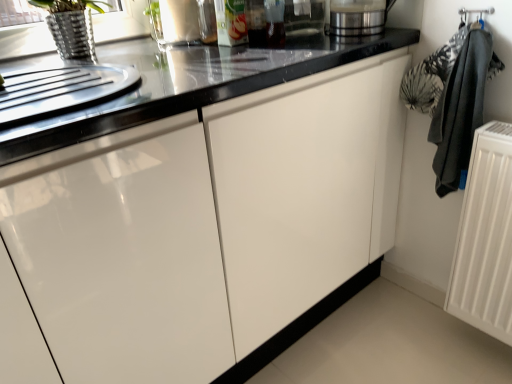
Question: Does black fabric laundry at right lie in front of satin silver blender at upper right, arranged as the second appliance when viewed from the left?

Choices:
 (A) yes
 (B) no

Answer: (A)

Question: From a real-world perspective, is black fabric laundry at right on top of satin silver blender at upper right, arranged as the second appliance when viewed from the left?

Choices:
 (A) yes
 (B) no

Answer: (B)

Question: Does black fabric laundry at right have a lesser width compared to satin silver blender at upper right, the 1th appliance positioned from the right?

Choices:
 (A) yes
 (B) no

Answer: (A)

Question: Can you see black fabric laundry at right touching satin silver blender at upper right, arranged as the second appliance when viewed from the left?

Choices:
 (A) yes
 (B) no

Answer: (B)

Question: Is black fabric laundry at right facing away from satin silver blender at upper right, the 1th appliance positioned from the right?

Choices:
 (A) yes
 (B) no

Answer: (B)

Question: Is white matte radiator at right situated inside satin silver blender at upper right, the 1th appliance positioned from the right, or outside?

Choices:
 (A) outside
 (B) inside

Answer: (A)

Question: In terms of height, does white matte radiator at right look taller or shorter compared to satin silver blender at upper right, the 1th appliance positioned from the right?

Choices:
 (A) short
 (B) tall

Answer: (B)

Question: From the image's perspective, is white matte radiator at right located above or below satin silver blender at upper right, arranged as the second appliance when viewed from the left?

Choices:
 (A) above
 (B) below

Answer: (B)

Question: Does point (487, 248) appear closer or farther from the camera than point (353, 11)?

Choices:
 (A) closer
 (B) farther

Answer: (A)

Question: Is satin silver blender at upper right, the 1th appliance positioned from the right, wider or thinner than white matte radiator at right?

Choices:
 (A) thin
 (B) wide

Answer: (B)

Question: From a real-world perspective, is satin silver blender at upper right, arranged as the second appliance when viewed from the left, above or below white matte radiator at right?

Choices:
 (A) above
 (B) below

Answer: (A)

Question: Based on their sizes in the image, would you say satin silver blender at upper right, arranged as the second appliance when viewed from the left, is bigger or smaller than white matte radiator at right?

Choices:
 (A) big
 (B) small

Answer: (B)

Question: Relative to white matte radiator at right, is satin silver blender at upper right, arranged as the second appliance when viewed from the left, in front or behind?

Choices:
 (A) front
 (B) behind

Answer: (B)

Question: Considering the positions of point (462, 278) and point (481, 97), is point (462, 278) closer or farther from the camera than point (481, 97)?

Choices:
 (A) farther
 (B) closer

Answer: (A)

Question: Which is correct: white matte radiator at right is inside black fabric laundry at right, or outside of it?

Choices:
 (A) inside
 (B) outside

Answer: (B)